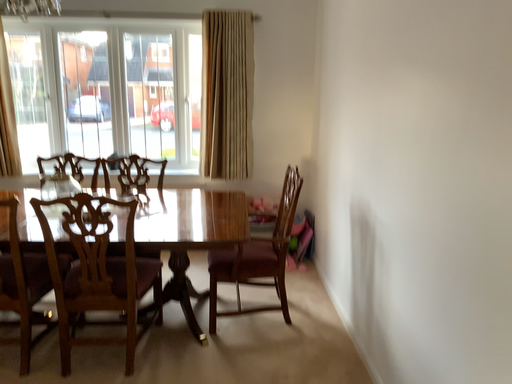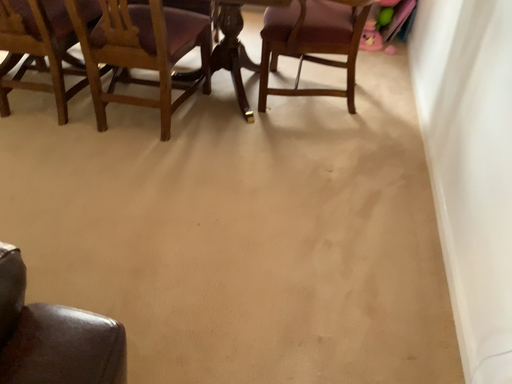
Question: Which way did the camera rotate in the video?

Choices:
 (A) rotated upward
 (B) rotated downward

Answer: (B)